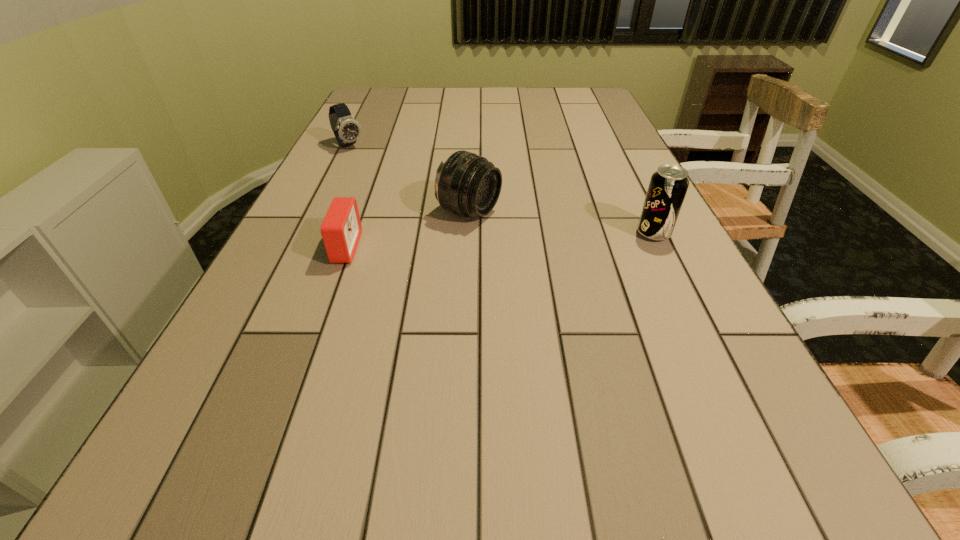
Find the location of `empty space between the third object from left to right and the second object from left to right`. empty space between the third object from left to right and the second object from left to right is located at coordinates (407, 230).

You are a GUI agent. You are given a task and a screenshot of the screen. Output one action in this format:
    pyautogui.click(x=<x>, y=<y>)
    Task: Click on the object identified as the closest to the second object from left to right
    This screenshot has width=960, height=540.
    Given the screenshot: What is the action you would take?
    pyautogui.click(x=467, y=184)

Where is `object that is the nearest to the second shortest object`? The height and width of the screenshot is (540, 960). object that is the nearest to the second shortest object is located at coordinates (467, 184).

The width and height of the screenshot is (960, 540). In order to click on blank space that satisfies the following two spatial constraints: 1. on the front side of the farthest object; 2. on the left side of the soda can in this screenshot , I will do `click(305, 234)`.

Locate an element on the screen. The height and width of the screenshot is (540, 960). blank area in the image that satisfies the following two spatial constraints: 1. on the front side of the second object from left to right; 2. on the front-facing side of the leftmost object is located at coordinates [298, 248].

I want to click on vacant position in the image that satisfies the following two spatial constraints: 1. on the front side of the rightmost object; 2. on the right side of the telephoto lens, so click(468, 234).